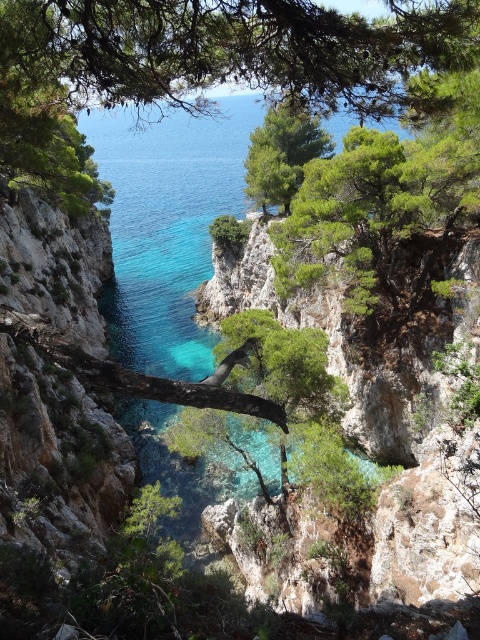
Question: Which object appears farthest from the camera in this image?

Choices:
 (A) green leafy tree at center
 (B) green leafy tree at upper center

Answer: (A)

Question: Is the position of green leafy tree at upper center more distant than that of green leafy tree at center?

Choices:
 (A) yes
 (B) no

Answer: (B)

Question: Is green leafy tree at upper center above green leafy tree at center?

Choices:
 (A) yes
 (B) no

Answer: (B)

Question: Can you confirm if green leafy tree at upper center is positioned to the left of green leafy tree at center?

Choices:
 (A) yes
 (B) no

Answer: (A)